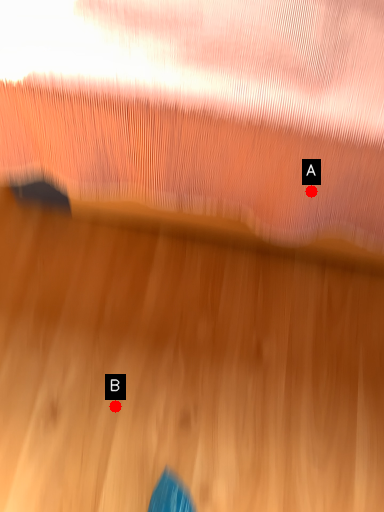
Question: Two points are circled on the image, labeled by A and B beside each circle. Which point appears farthest from the camera in this image?

Choices:
 (A) A is further
 (B) B is further

Answer: (B)